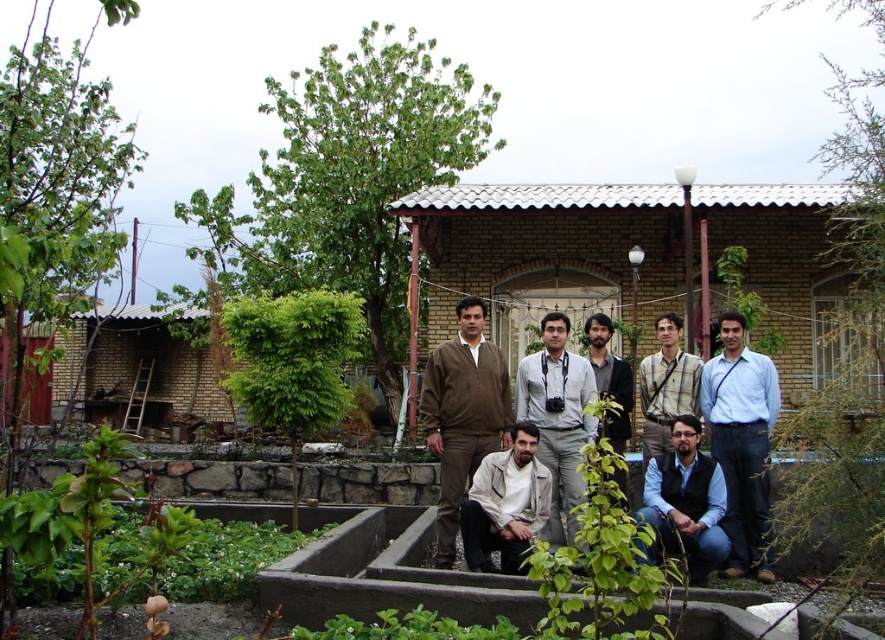
Is brown matte sweater at center thinner than light beige fabric shirt at lower center?

No.

Can you confirm if brown matte sweater at center is positioned to the left of light beige fabric shirt at lower center?

Correct, you'll find brown matte sweater at center to the left of light beige fabric shirt at lower center.

Image resolution: width=885 pixels, height=640 pixels. What do you see at coordinates (463, 413) in the screenshot?
I see `brown matte sweater at center` at bounding box center [463, 413].

Identify the location of brown matte sweater at center. The image size is (885, 640). (463, 413).

Where is `light gray fabric shirt at center`? Image resolution: width=885 pixels, height=640 pixels. light gray fabric shirt at center is located at coordinates (558, 419).

Does light gray fabric shirt at center appear on the right side of dark blue jeans at lower center?

In fact, light gray fabric shirt at center is to the left of dark blue jeans at lower center.

Does point (526, 362) come farther from viewer compared to point (687, 452)?

Yes, point (526, 362) is behind point (687, 452).

Where is `light gray fabric shirt at center`? Image resolution: width=885 pixels, height=640 pixels. light gray fabric shirt at center is located at coordinates (558, 419).

Between dark blue jeans at lower center and light brown shirt at center, which one has less height?

With less height is dark blue jeans at lower center.

Is dark blue jeans at lower center positioned in front of light brown shirt at center?

Yes.

Who is more forward, (689, 484) or (643, 452)?

Point (689, 484) is more forward.

Where is `dark blue jeans at lower center`? dark blue jeans at lower center is located at coordinates (685, 502).